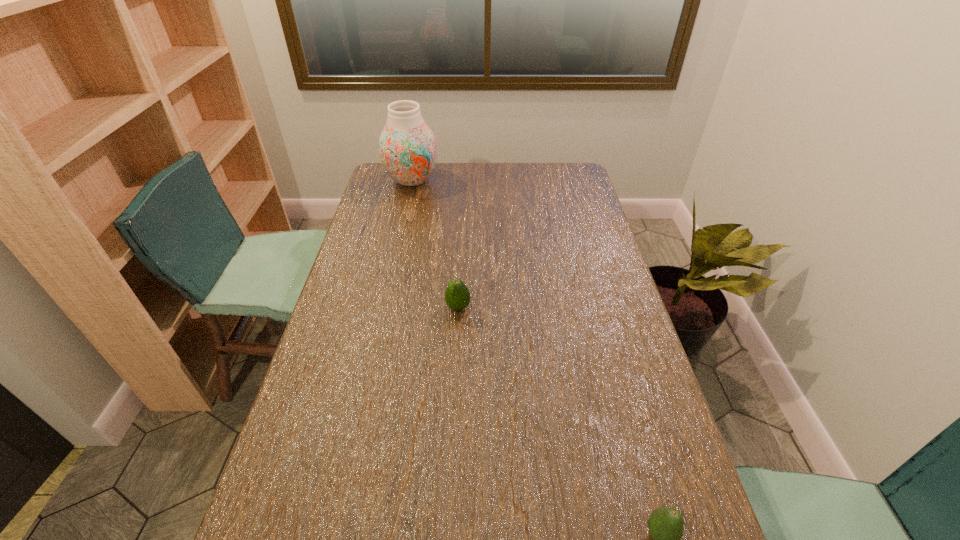
Where is `free location at the left edge of the desktop`? The width and height of the screenshot is (960, 540). free location at the left edge of the desktop is located at coordinates (363, 237).

Where is `free point at the right edge`? free point at the right edge is located at coordinates (552, 195).

Find the location of a particular element. The image size is (960, 540). vacant area that lies between the left avocado and the vase is located at coordinates (435, 244).

Locate an element on the screen. This screenshot has width=960, height=540. free point between the vase and the second shortest object is located at coordinates (435, 244).

The width and height of the screenshot is (960, 540). In order to click on vacant region between the taller avocado and the leftmost object in this screenshot , I will do `click(435, 244)`.

Identify which object is the second nearest to the leftmost object. Please provide its 2D coordinates. Your answer should be formatted as a tuple, i.e. [(x, y)], where the tuple contains the x and y coordinates of a point satisfying the conditions above.

[(665, 525)]

Locate an element on the screen. The height and width of the screenshot is (540, 960). object that stands as the second closest to the second farthest object is located at coordinates (665, 525).

The width and height of the screenshot is (960, 540). Find the location of `free space that satisfies the following two spatial constraints: 1. on the front side of the farther avocado; 2. on the left side of the farthest object`. free space that satisfies the following two spatial constraints: 1. on the front side of the farther avocado; 2. on the left side of the farthest object is located at coordinates (383, 308).